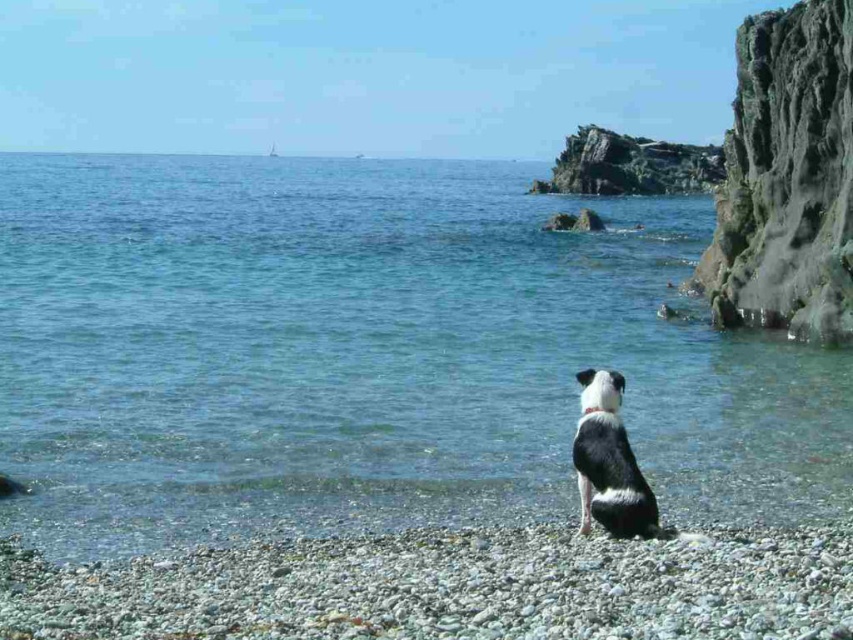
Between point (486, 637) and point (708, 296), which one is positioned in front?

Positioned in front is point (486, 637).

Who is positioned more to the right, smooth pebbles at lower center or green mossy rock at right?

Positioned to the right is green mossy rock at right.

Is point (383, 593) closer to camera compared to point (773, 168)?

Yes, point (383, 593) is closer to viewer.

At what (x,y) coordinates should I click in order to perform the action: click on smooth pebbles at lower center. Please return your answer as a coordinate pair (x, y). The width and height of the screenshot is (853, 640). Looking at the image, I should click on (448, 588).

Who is more forward, (340, 566) or (622, 385)?

Positioned in front is point (340, 566).

What do you see at coordinates (448, 588) in the screenshot? I see `smooth pebbles at lower center` at bounding box center [448, 588].

What do you see at coordinates (448, 588) in the screenshot?
I see `smooth pebbles at lower center` at bounding box center [448, 588].

Locate an element on the screen. smooth pebbles at lower center is located at coordinates (448, 588).

Is clear blue water at center thinner than black and white fur dog at center?

No.

Can you confirm if clear blue water at center is smaller than black and white fur dog at center?

No, clear blue water at center is not smaller than black and white fur dog at center.

Find the location of a particular element. Image resolution: width=853 pixels, height=640 pixels. clear blue water at center is located at coordinates (369, 355).